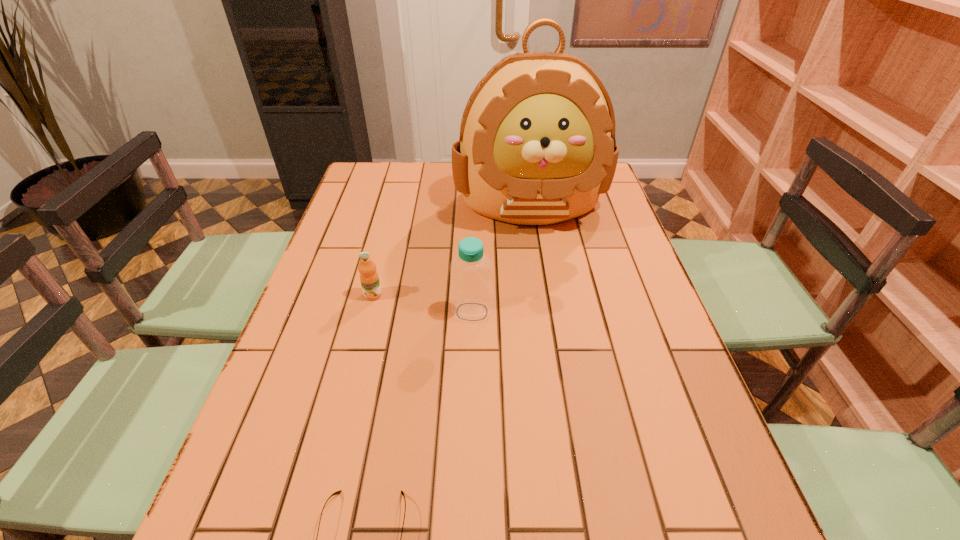
Image resolution: width=960 pixels, height=540 pixels. In order to click on the farthest object in this screenshot , I will do `click(537, 146)`.

Where is `the tallest object`? The width and height of the screenshot is (960, 540). the tallest object is located at coordinates (537, 146).

Find the location of a particular element. This screenshot has width=960, height=540. the second tallest object is located at coordinates (471, 294).

Locate an element on the screen. The height and width of the screenshot is (540, 960). the second shortest object is located at coordinates (369, 278).

This screenshot has width=960, height=540. I want to click on vacant space located 0.130m on the front-facing side of the farthest object, so click(x=540, y=268).

Where is `vacant area located 0.080m on the left of the bottle`? This screenshot has height=540, width=960. vacant area located 0.080m on the left of the bottle is located at coordinates (419, 312).

The height and width of the screenshot is (540, 960). What are the coordinates of `vacant space situated 0.400m on the label of the third tallest object` in the screenshot? It's located at (332, 453).

Find the location of a particular element. Image resolution: width=960 pixels, height=540 pixels. object at the far edge is located at coordinates (537, 146).

The width and height of the screenshot is (960, 540). I want to click on object that is positioned at the left edge, so click(x=369, y=278).

I want to click on object at the right edge, so click(x=537, y=146).